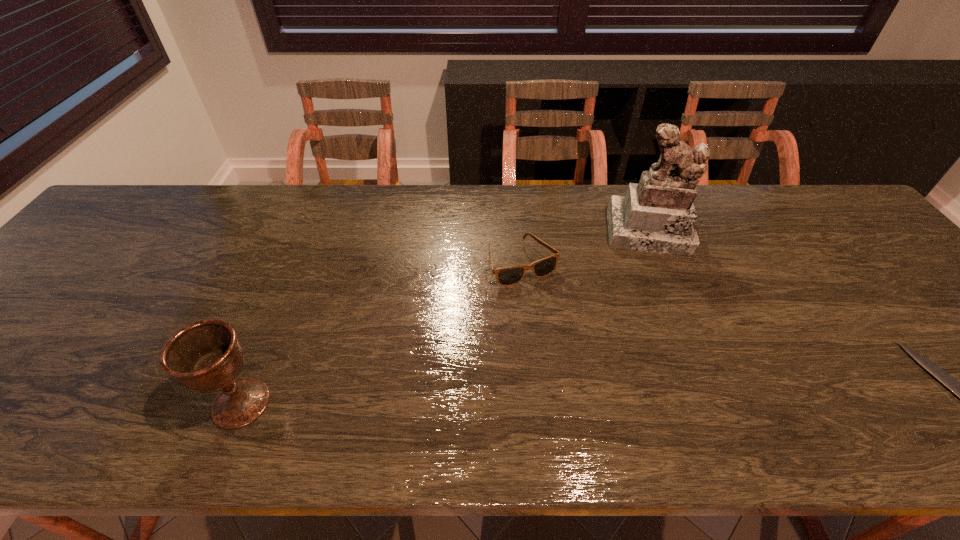
Where is `chalice`? This screenshot has width=960, height=540. chalice is located at coordinates (206, 356).

You are a GUI agent. You are given a task and a screenshot of the screen. Output one action in this format:
    pyautogui.click(x=<x>, y=<y>)
    Task: Click on the third shortest object
    This screenshot has width=960, height=540.
    Given the screenshot: What is the action you would take?
    pyautogui.click(x=206, y=356)

In order to click on sunglasses in this screenshot , I will do `click(508, 276)`.

Locate an element on the screen. The height and width of the screenshot is (540, 960). the third object from right to left is located at coordinates (508, 276).

Locate an element on the screen. This screenshot has width=960, height=540. the tallest object is located at coordinates (657, 215).

This screenshot has height=540, width=960. I want to click on figurine, so click(657, 215).

Locate an element on the screen. The image size is (960, 540). vacant space located 0.160m on the left of the leftmost object is located at coordinates (132, 403).

Where is `vacant space situated 0.080m on the frames of the third tallest object`? vacant space situated 0.080m on the frames of the third tallest object is located at coordinates (551, 308).

Where is `vacant space located 0.180m on the frames of the third tallest object`? The image size is (960, 540). vacant space located 0.180m on the frames of the third tallest object is located at coordinates (570, 340).

In order to click on vacant position located 0.260m on the frames of the third tallest object in this screenshot , I will do `click(588, 369)`.